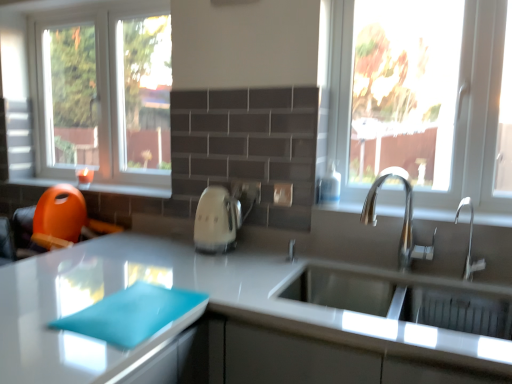
Question: Is metallic silver sink at right, marked as the 1th window sill in a bottom-to-top arrangement, further to the viewer compared to clear glass window at left, the first window positioned from the left?

Choices:
 (A) yes
 (B) no

Answer: (B)

Question: Is metallic silver sink at right, arranged as the 2th window sill when viewed from the back, far from clear glass window at left, arranged as the second window when viewed from the right?

Choices:
 (A) no
 (B) yes

Answer: (B)

Question: Is metallic silver sink at right, arranged as the 1th window sill when viewed from the front, thinner than clear glass window at left, the second window in the front-to-back sequence?

Choices:
 (A) no
 (B) yes

Answer: (A)

Question: Can you confirm if metallic silver sink at right, arranged as the first window sill when viewed from the right, is positioned to the left of clear glass window at left, arranged as the 1th window when viewed from the back?

Choices:
 (A) yes
 (B) no

Answer: (B)

Question: Does metallic silver sink at right, arranged as the 2th window sill when viewed from the back, have a larger size compared to clear glass window at left, arranged as the 1th window when viewed from the back?

Choices:
 (A) no
 (B) yes

Answer: (A)

Question: From the image's perspective, is silver metallic faucet at center, placed as the first tap when sorted from left to right, positioned above or below transparent glass window at upper right, arranged as the 2th window when viewed from the left?

Choices:
 (A) above
 (B) below

Answer: (B)

Question: Is silver metallic faucet at center, the second tap when ordered from right to left, taller or shorter than transparent glass window at upper right, which is the 2th window in back-to-front order?

Choices:
 (A) tall
 (B) short

Answer: (B)

Question: Is silver metallic faucet at center, placed as the first tap when sorted from left to right, bigger or smaller than transparent glass window at upper right, the first window from the right?

Choices:
 (A) big
 (B) small

Answer: (B)

Question: Considering their positions, is silver metallic faucet at center, the second tap when ordered from right to left, located in front of or behind transparent glass window at upper right, which is the 2th window in back-to-front order?

Choices:
 (A) behind
 (B) front

Answer: (B)

Question: Looking at their shapes, would you say transparent glass window at upper right, the first window from the right, is wider or thinner than white glossy cutting board at lower left?

Choices:
 (A) thin
 (B) wide

Answer: (A)

Question: Is transparent glass window at upper right, the first window from the right, bigger or smaller than white glossy cutting board at lower left?

Choices:
 (A) big
 (B) small

Answer: (B)

Question: From the image's perspective, is transparent glass window at upper right, arranged as the 2th window when viewed from the left, above or below white glossy cutting board at lower left?

Choices:
 (A) below
 (B) above

Answer: (B)

Question: Would you say transparent glass window at upper right, the first window from the right, is to the left or to the right of white glossy cutting board at lower left in the picture?

Choices:
 (A) right
 (B) left

Answer: (A)

Question: Relative to white glossy cutting board at lower left, is silver metallic faucet at center, placed as the first tap when sorted from left to right, in front or behind?

Choices:
 (A) front
 (B) behind

Answer: (B)

Question: Is silver metallic faucet at center, placed as the first tap when sorted from left to right, wider or thinner than white glossy cutting board at lower left?

Choices:
 (A) thin
 (B) wide

Answer: (A)